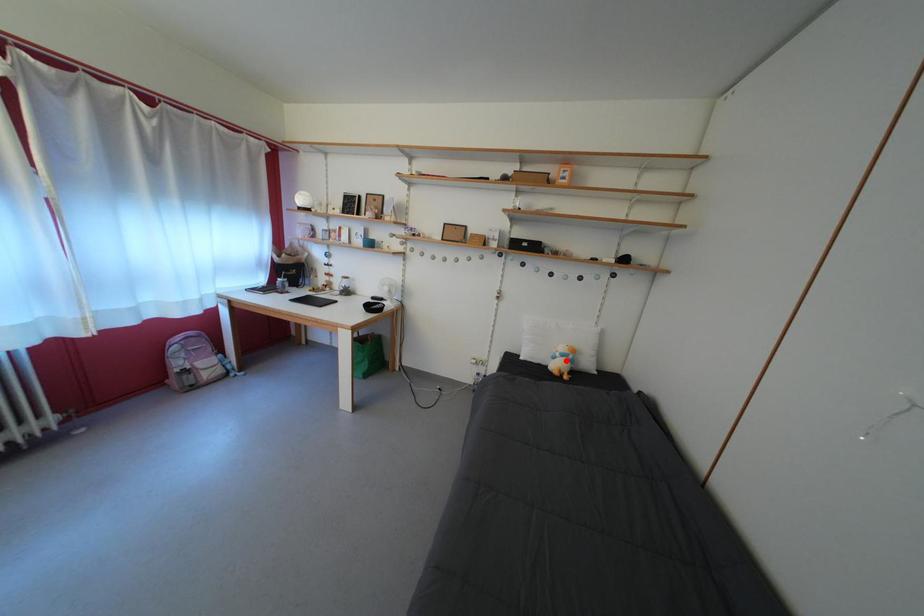
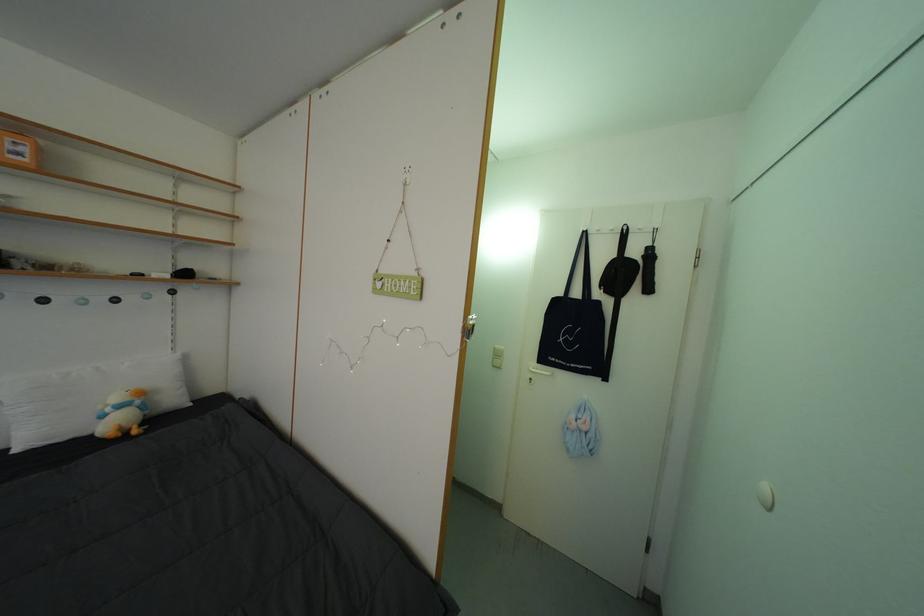
The point at the highlighted location is marked in the first image. Where is the corresponding point in the second image?

(117, 415)